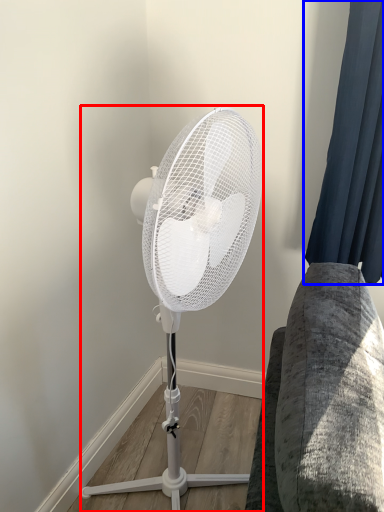
Question: Which point is closer to the camera, mechanical fan (highlighted by a red box) or curtain (highlighted by a blue box)?

Choices:
 (A) mechanical fan
 (B) curtain

Answer: (A)